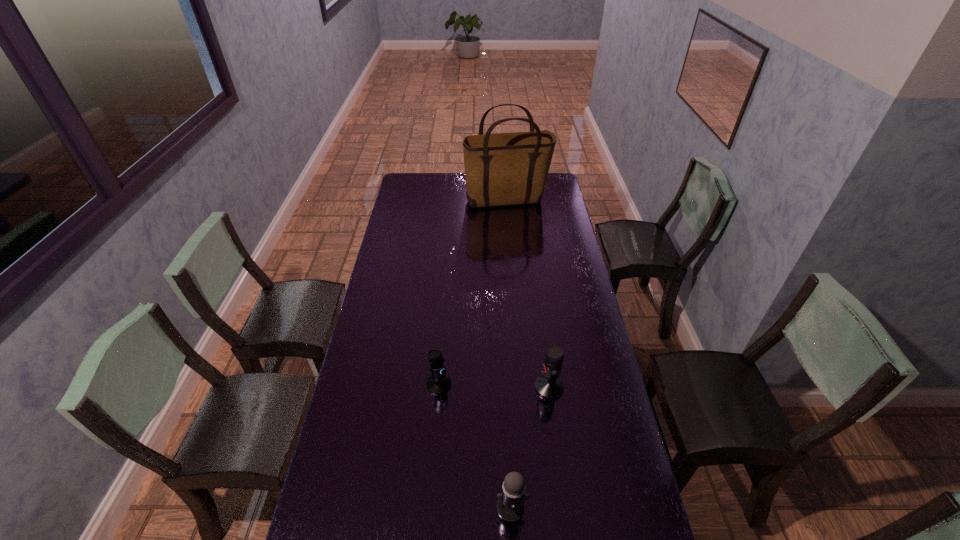
This screenshot has height=540, width=960. In order to click on vacant point located between the shortest object and the rightmost microphone in this screenshot , I will do `click(494, 386)`.

This screenshot has height=540, width=960. Identify the location of free area in between the nearest microphone and the rightmost microphone. (530, 447).

Locate an element on the screen. The height and width of the screenshot is (540, 960). free space between the tote bag and the leftmost microphone is located at coordinates 473,292.

Image resolution: width=960 pixels, height=540 pixels. What are the coordinates of `vacant area between the rightmost microphone and the nearest object` in the screenshot? It's located at (530, 447).

What are the coordinates of `unoccupied position between the nearest object and the rightmost microphone` in the screenshot? It's located at (530, 447).

At what (x,y) coordinates should I click in order to perform the action: click on blank region between the rightmost microphone and the shortest object. Please return your answer as a coordinate pair (x, y). The image size is (960, 540). Looking at the image, I should click on (494, 386).

The image size is (960, 540). What are the coordinates of `free spot between the nearest object and the rightmost microphone` in the screenshot? It's located at (530, 447).

What are the coordinates of `vacant space that is in between the shortest object and the rightmost microphone` in the screenshot? It's located at (494, 386).

The width and height of the screenshot is (960, 540). Identify the location of vacant area that lies between the nearest object and the farthest object. (509, 354).

Where is `object that stands as the third closest to the nearest microphone`? The height and width of the screenshot is (540, 960). object that stands as the third closest to the nearest microphone is located at coordinates (502, 169).